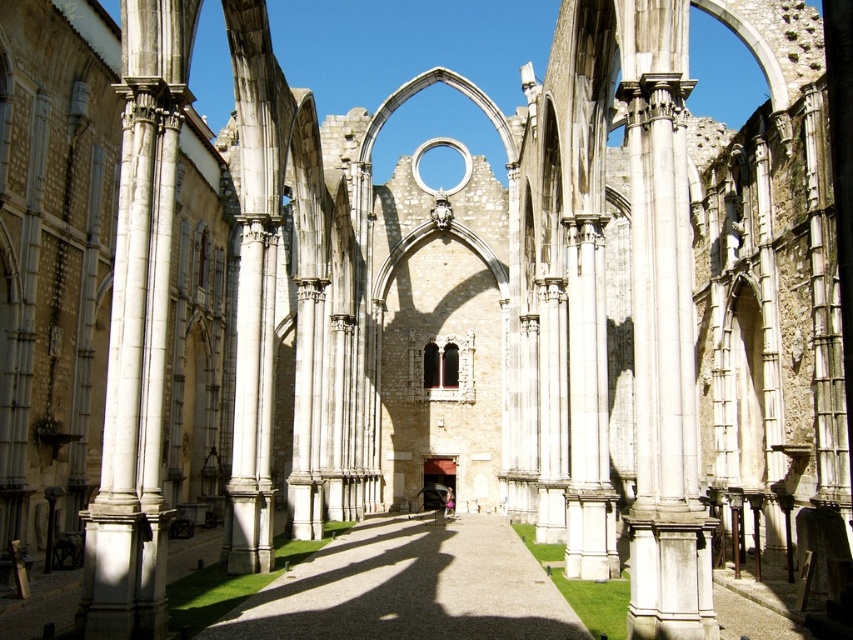
You are an architect assessing the space for a new sculpture installation. The sculpture requires a base that must be wider than the white marble column at left but narrower than the gravel pathway at center. Is there a suitable location between these two objects to place the sculpture base?

The white marble column at left has a lesser width compared to gravel pathway at center, so there is a suitable location between them where the sculpture base can be placed as long as it is wider than the column but narrower than the pathway.

You are standing at the entrance of the historic stone structure and see the white marble column at left and the gravel pathway at center. Which object is positioned higher relative to the other?

The white marble column at left is positioned above the gravel pathway at center, meaning it is higher.